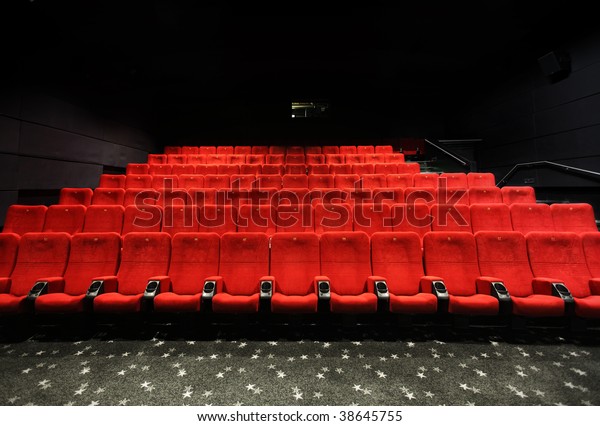
Find the location of a particular element. The height and width of the screenshot is (426, 600). cup holder is located at coordinates (41, 290), (94, 289), (152, 285), (208, 284), (266, 285), (322, 290), (379, 286), (438, 287), (502, 290), (562, 290).